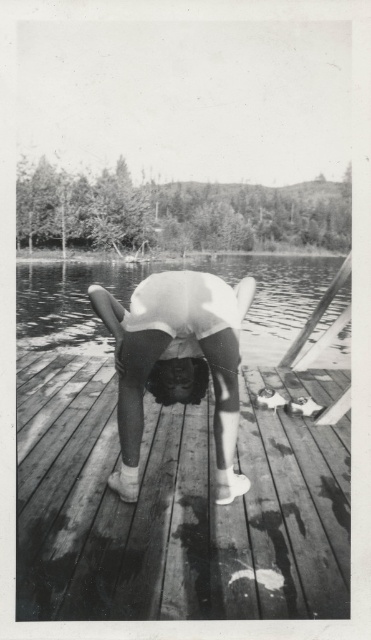
Question: Can you confirm if white matte shorts at center is positioned below transparent water at center?

Choices:
 (A) yes
 (B) no

Answer: (A)

Question: Can you confirm if wooden at center is positioned to the left of transparent water at center?

Choices:
 (A) no
 (B) yes

Answer: (A)

Question: Does white matte shorts at center appear under transparent water at center?

Choices:
 (A) yes
 (B) no

Answer: (A)

Question: Which point appears farthest from the camera in this image?

Choices:
 (A) (209, 348)
 (B) (192, 515)
 (C) (349, 324)

Answer: (C)

Question: Which point is closer to the camera?

Choices:
 (A) white matte shorts at center
 (B) wooden at center
 (C) transparent water at center

Answer: (B)

Question: Which object is the closest to the transparent water at center?

Choices:
 (A) white matte shorts at center
 (B) wooden at center

Answer: (B)